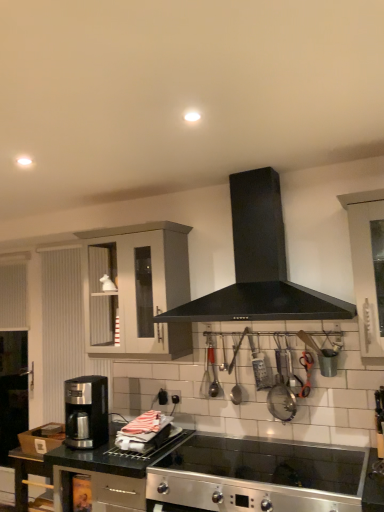
Question: Is satin black coffee maker at lower left taller than black granite countertop at lower left, which ranks as the second countertop in right-to-left order?

Choices:
 (A) yes
 (B) no

Answer: (B)

Question: Is satin black coffee maker at lower left far from black granite countertop at lower left, which ranks as the second countertop in right-to-left order?

Choices:
 (A) no
 (B) yes

Answer: (A)

Question: Can black granite countertop at lower left, which ranks as the second countertop in right-to-left order, be found inside satin black coffee maker at lower left?

Choices:
 (A) no
 (B) yes

Answer: (A)

Question: Does satin black coffee maker at lower left appear on the right side of black granite countertop at lower left, which ranks as the second countertop in right-to-left order?

Choices:
 (A) no
 (B) yes

Answer: (A)

Question: Is satin black coffee maker at lower left closer to the viewer compared to black granite countertop at lower left, the 1th countertop positioned from the left?

Choices:
 (A) no
 (B) yes

Answer: (A)

Question: Is satin black coffee maker at lower left completely or partially outside of black granite countertop at lower left, the 1th countertop positioned from the left?

Choices:
 (A) yes
 (B) no

Answer: (A)

Question: From the image's perspective, is matte gray cabinet at upper left located beneath black granite countertop at lower left, the 1th countertop positioned from the left?

Choices:
 (A) no
 (B) yes

Answer: (A)

Question: Are matte gray cabinet at upper left and black granite countertop at lower left, the 1th countertop positioned from the left, beside each other?

Choices:
 (A) yes
 (B) no

Answer: (B)

Question: Considering the relative sizes of matte gray cabinet at upper left and black granite countertop at lower left, the 1th countertop positioned from the left, in the image provided, is matte gray cabinet at upper left bigger than black granite countertop at lower left, the 1th countertop positioned from the left,?

Choices:
 (A) yes
 (B) no

Answer: (B)

Question: Is matte gray cabinet at upper left outside black granite countertop at lower left, which ranks as the second countertop in right-to-left order?

Choices:
 (A) no
 (B) yes

Answer: (B)

Question: Considering the relative sizes of matte gray cabinet at upper left and black granite countertop at lower left, the 1th countertop positioned from the left, in the image provided, is matte gray cabinet at upper left taller than black granite countertop at lower left, the 1th countertop positioned from the left,?

Choices:
 (A) yes
 (B) no

Answer: (A)

Question: Does matte gray cabinet at upper left come behind black granite countertop at lower left, the 1th countertop positioned from the left?

Choices:
 (A) yes
 (B) no

Answer: (A)

Question: Is satin black coffee maker at lower left bigger than matte gray cabinet at upper left?

Choices:
 (A) no
 (B) yes

Answer: (A)